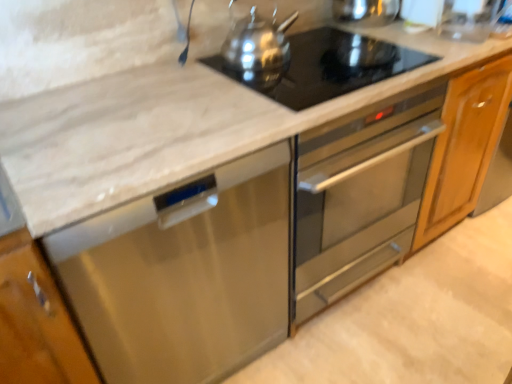
You are a GUI agent. You are given a task and a screenshot of the screen. Output one action in this format:
    pyautogui.click(x=<x>, y=<y>)
    Task: Click on the black glass cooktop at upper center
    Image resolution: width=512 pixels, height=384 pixels.
    Given the screenshot: What is the action you would take?
    pyautogui.click(x=329, y=66)

What do you see at coordinates (36, 321) in the screenshot? I see `white marble cabinet at lower left` at bounding box center [36, 321].

You are a GUI agent. You are given a task and a screenshot of the screen. Output one action in this format:
    pyautogui.click(x=<x>, y=<y>)
    Task: Click on the polished stainless steel kettle at upper center
    
    Given the screenshot: What is the action you would take?
    pyautogui.click(x=256, y=37)

Is black glass cooktop at upper center surrounded by stainless steel dishwasher at lower left?

No, black glass cooktop at upper center is located outside of stainless steel dishwasher at lower left.

Considering the positions of point (109, 266) and point (310, 57), is point (109, 266) closer or farther from the camera than point (310, 57)?

Point (109, 266) appears to be closer to the viewer than point (310, 57).

Looking at the image, does stainless steel dishwasher at lower left seem bigger or smaller compared to black glass cooktop at upper center?

In the image, stainless steel dishwasher at lower left appears to be larger than black glass cooktop at upper center.

Which is in front, point (8, 338) or point (209, 271)?

The point (8, 338) is closer to the camera.

Where is `cabinetry in front of the stainless steel dishwasher at lower left`? This screenshot has width=512, height=384. cabinetry in front of the stainless steel dishwasher at lower left is located at coordinates (36, 321).

How distant is white marble cabinet at lower left from stainless steel dishwasher at lower left?

9.04 inches.

Does white marble cabinet at lower left touch stainless steel dishwasher at lower left?

white marble cabinet at lower left is not next to stainless steel dishwasher at lower left, and they're not touching.

Does stainless steel dishwasher at lower left have a smaller size compared to polished stainless steel kettle at upper center?

Actually, stainless steel dishwasher at lower left might be larger than polished stainless steel kettle at upper center.

Is stainless steel dishwasher at lower left positioned with its back to polished stainless steel kettle at upper center?

No, stainless steel dishwasher at lower left is not facing away from polished stainless steel kettle at upper center.

Does stainless steel dishwasher at lower left touch polished stainless steel kettle at upper center?

stainless steel dishwasher at lower left is not next to polished stainless steel kettle at upper center, and they're not touching.

From a real-world perspective, which is physically above, stainless steel dishwasher at lower left or polished stainless steel kettle at upper center?

polished stainless steel kettle at upper center is physically above.

Considering the sizes of objects polished stainless steel kettle at upper center and white marble cabinet at lower left in the image provided, who is smaller, polished stainless steel kettle at upper center or white marble cabinet at lower left?

Smaller between the two is polished stainless steel kettle at upper center.

From a real-world perspective, which is physically below, polished stainless steel kettle at upper center or white marble cabinet at lower left?

white marble cabinet at lower left, from a real-world perspective.

How different are the orientations of polished stainless steel kettle at upper center and white marble cabinet at lower left in degrees?

They differ by 4.02 degrees in their facing directions.

Looking at their sizes, would you say polished stainless steel kettle at upper center is wider or thinner than white marble cabinet at lower left?

Clearly, polished stainless steel kettle at upper center has less width compared to white marble cabinet at lower left.

Is black glass cooktop at upper center surrounding polished stainless steel kettle at upper center?

That's incorrect, polished stainless steel kettle at upper center is not inside black glass cooktop at upper center.

Locate an element on the screen. gas stove below the polished stainless steel kettle at upper center (from the image's perspective) is located at coordinates (329, 66).

Which is farther, (429, 60) or (283, 21)?

The point (283, 21) is behind.

Between black glass cooktop at upper center and polished stainless steel kettle at upper center, which one has larger size?

With larger size is polished stainless steel kettle at upper center.

From the image's perspective, which is below, white marble cabinet at lower left or polished stainless steel kettle at upper center?

white marble cabinet at lower left.

Is point (66, 350) closer to viewer compared to point (231, 61)?

Yes, point (66, 350) is in front of point (231, 61).

From the picture: Would you say white marble cabinet at lower left is inside or outside polished stainless steel kettle at upper center?

white marble cabinet at lower left is not enclosed by polished stainless steel kettle at upper center.

Is white marble cabinet at lower left directly adjacent to polished stainless steel kettle at upper center?

No, white marble cabinet at lower left is not touching polished stainless steel kettle at upper center.

Is polished stainless steel kettle at upper center far from stainless steel dishwasher at lower left?

No, there isn't a large distance between polished stainless steel kettle at upper center and stainless steel dishwasher at lower left.

Is polished stainless steel kettle at upper center looking in the opposite direction of stainless steel dishwasher at lower left?

No, polished stainless steel kettle at upper center's orientation is not away from stainless steel dishwasher at lower left.

Is polished stainless steel kettle at upper center inside the boundaries of stainless steel dishwasher at lower left, or outside?

The correct answer is: outside.

In terms of width, does polished stainless steel kettle at upper center look wider or thinner when compared to stainless steel dishwasher at lower left?

In the image, polished stainless steel kettle at upper center appears to be more narrow than stainless steel dishwasher at lower left.

Locate an element on the screen. The image size is (512, 384). gas stove on the right of stainless steel dishwasher at lower left is located at coordinates click(x=329, y=66).

Image resolution: width=512 pixels, height=384 pixels. I want to click on dish washer above the white marble cabinet at lower left (from the image's perspective), so click(184, 275).

From the image, which object appears to be nearer to stainless steel dishwasher at lower left, black glass cooktop at upper center or polished stainless steel kettle at upper center?

black glass cooktop at upper center is closer to stainless steel dishwasher at lower left.

From the image, which object appears to be farther from stainless steel dishwasher at lower left, polished stainless steel kettle at upper center or white marble cabinet at lower left?

polished stainless steel kettle at upper center is further to stainless steel dishwasher at lower left.

Looking at the image, which one is located further to white marble cabinet at lower left, black glass cooktop at upper center or polished stainless steel kettle at upper center?

polished stainless steel kettle at upper center.

Estimate the real-world distances between objects in this image. Which object is further from polished stainless steel kettle at upper center, stainless steel dishwasher at lower left or white marble cabinet at lower left?

white marble cabinet at lower left.

Considering their positions, is white marble cabinet at lower left positioned further to stainless steel dishwasher at lower left than polished stainless steel kettle at upper center?

Based on the image, polished stainless steel kettle at upper center appears to be further to stainless steel dishwasher at lower left.

Considering their positions, is white marble cabinet at lower left positioned closer to black glass cooktop at upper center than stainless steel dishwasher at lower left?

stainless steel dishwasher at lower left lies closer to black glass cooktop at upper center than the other object.

Which object lies nearer to the anchor point stainless steel dishwasher at lower left, black glass cooktop at upper center or white marble cabinet at lower left?

white marble cabinet at lower left is positioned closer to the anchor stainless steel dishwasher at lower left.

Looking at the image, which one is located further to polished stainless steel kettle at upper center, black glass cooktop at upper center or white marble cabinet at lower left?

white marble cabinet at lower left is further to polished stainless steel kettle at upper center.

Find the location of a particular element. This screenshot has height=384, width=512. dish washer between polished stainless steel kettle at upper center and white marble cabinet at lower left from top to bottom is located at coordinates (184, 275).

Find the location of `gas stove that lies between polished stainless steel kettle at upper center and stainless steel dishwasher at lower left from top to bottom`. gas stove that lies between polished stainless steel kettle at upper center and stainless steel dishwasher at lower left from top to bottom is located at coordinates (329, 66).

You are a GUI agent. You are given a task and a screenshot of the screen. Output one action in this format:
    pyautogui.click(x=<x>, y=<y>)
    Task: Click on the dish washer between white marble cabinet at lower left and black glass cooktop at upper center in the horizontal direction
    
    Given the screenshot: What is the action you would take?
    pyautogui.click(x=184, y=275)

Locate an element on the screen. The width and height of the screenshot is (512, 384). gas stove between polished stainless steel kettle at upper center and white marble cabinet at lower left vertically is located at coordinates (329, 66).